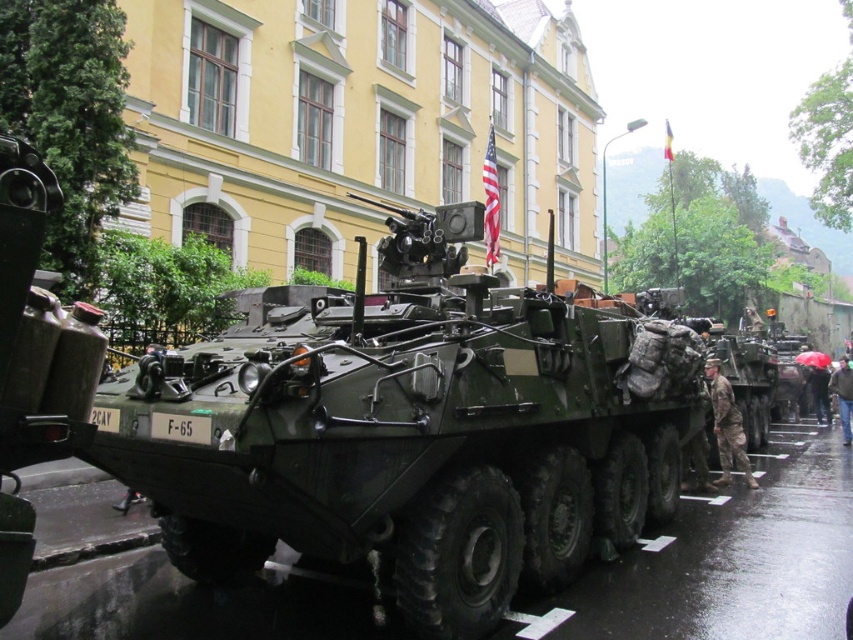
Question: Based on their relative distances, which object is nearer to the matte green armored vehicle at center?

Choices:
 (A) camouflage fabric soldier at lower right
 (B) matte green tank at center

Answer: (B)

Question: Which point appears farthest from the camera in this image?

Choices:
 (A) (20, 593)
 (B) (717, 376)
 (C) (844, 426)
 (D) (167, 552)

Answer: (C)

Question: Observing the image, what is the correct spatial positioning of matte green armored vehicle at center in reference to camouflage fabric soldier at lower right?

Choices:
 (A) below
 (B) above

Answer: (B)

Question: Which of the following is the farthest from the observer?

Choices:
 (A) camouflage fabric soldier at lower right
 (B) camouflage fabric uniform at center
 (C) matte green tank at center

Answer: (A)

Question: Is matte green armored vehicle at center positioned behind camouflage fabric soldier at lower right?

Choices:
 (A) no
 (B) yes

Answer: (A)

Question: Does matte green tank at center lie in front of camouflage fabric soldier at lower right?

Choices:
 (A) yes
 (B) no

Answer: (A)